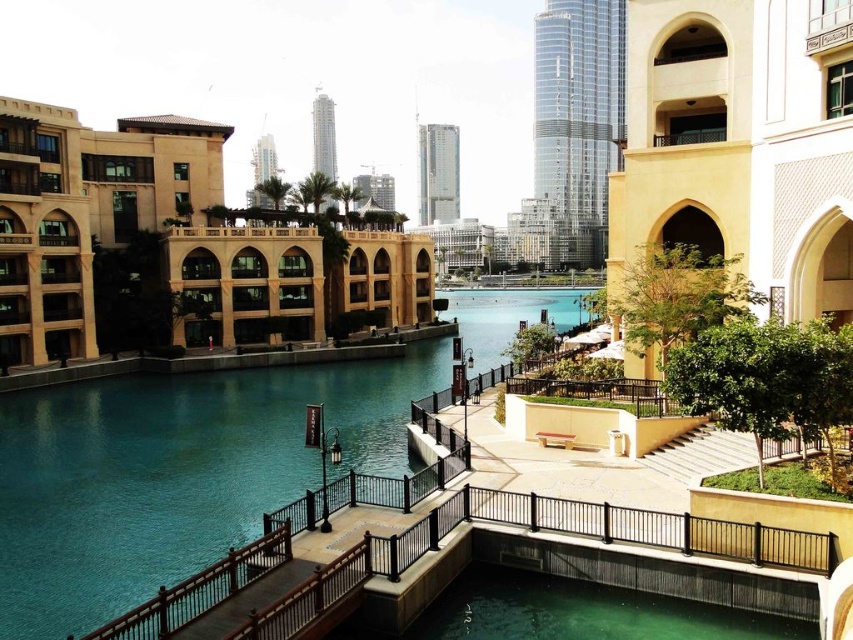
Question: Among these points, which one is farthest from the camera?

Choices:
 (A) (714, 538)
 (B) (509, 291)
 (C) (425, 138)
 (D) (183, 284)

Answer: (C)

Question: Observing the image, what is the correct spatial positioning of glassy reflective skyscraper at upper center in reference to smooth glass skyscraper at center?

Choices:
 (A) left
 (B) right

Answer: (B)

Question: Can you confirm if teal glossy water at center is positioned below beige stucco building at center-right?

Choices:
 (A) no
 (B) yes

Answer: (B)

Question: Among these points, which one is farthest from the camera?

Choices:
 (A) (621, 35)
 (B) (424, 179)
 (C) (312, 330)

Answer: (B)

Question: Can you confirm if beige stone building at left is positioned below smooth glass skyscraper at center?

Choices:
 (A) no
 (B) yes

Answer: (B)

Question: Which point is farther from the camera taking this photo?

Choices:
 (A) (12, 579)
 (B) (241, 556)

Answer: (A)